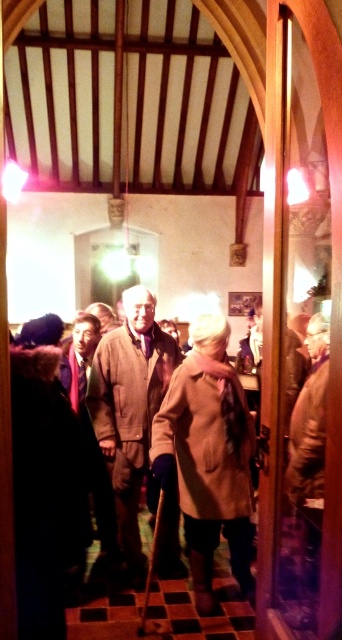
You are standing in the church and see two coats at the center. Which one is closer to the ground, the beige woolen trench coat at center or the beige wool coat at center?

The beige woolen trench coat at center is positioned under the beige wool coat at center, so it is closer to the ground.